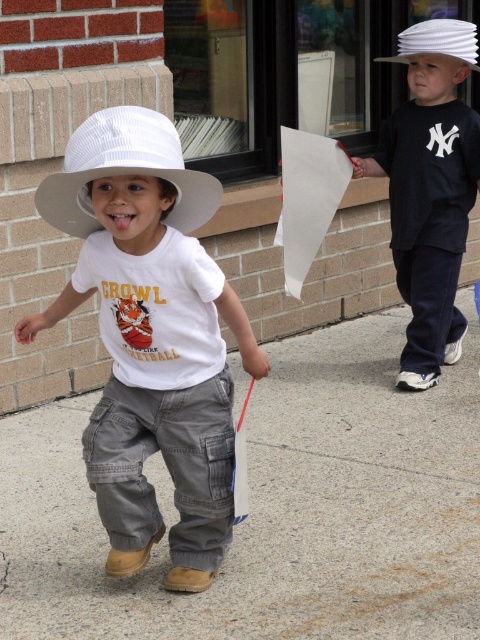
Does white matte hat at upper right have a greater width compared to white straw hat at left?

Correct, the width of white matte hat at upper right exceeds that of white straw hat at left.

Does white matte hat at upper right have a greater height compared to white straw hat at left?

Yes.

Who is more distant from viewer, (432, 45) or (197, 196)?

Positioned behind is point (432, 45).

Where is `white matte hat at upper right`? white matte hat at upper right is located at coordinates (430, 189).

Can you confirm if white straw hat at left is wider than white fabric cowboy hat at upper center?

Indeed, white straw hat at left has a greater width compared to white fabric cowboy hat at upper center.

Which of these two, white straw hat at left or white fabric cowboy hat at upper center, stands shorter?

With less height is white fabric cowboy hat at upper center.

Between point (115, 140) and point (465, 51), which one is positioned in front?

Point (115, 140) is in front.

Where is `white straw hat at left`? The width and height of the screenshot is (480, 640). white straw hat at left is located at coordinates (124, 170).

Is point (158, 180) more distant than point (455, 20)?

That is False.

Does matte white hat at left have a greater height compared to white fabric cowboy hat at upper center?

Yes, matte white hat at left is taller than white fabric cowboy hat at upper center.

Between point (140, 396) and point (448, 28), which one is positioned behind?

The point (448, 28) is behind.

Identify the location of matte white hat at left. (151, 337).